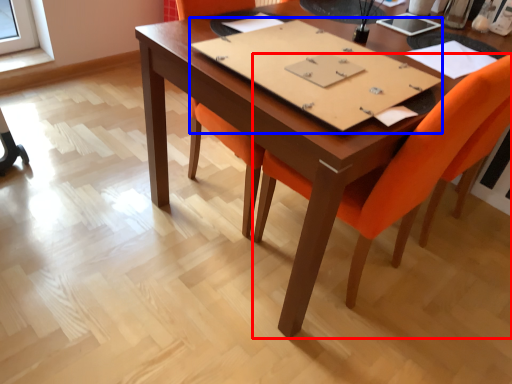
Question: Which point is further to the camera, chair (highlighted by a red box) or notebook (highlighted by a blue box)?

Choices:
 (A) chair
 (B) notebook

Answer: (B)